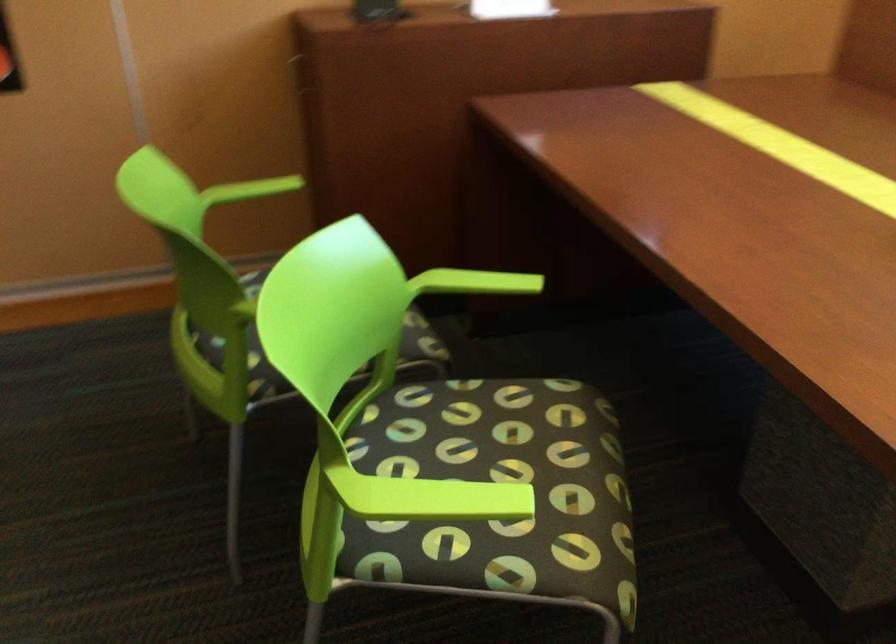
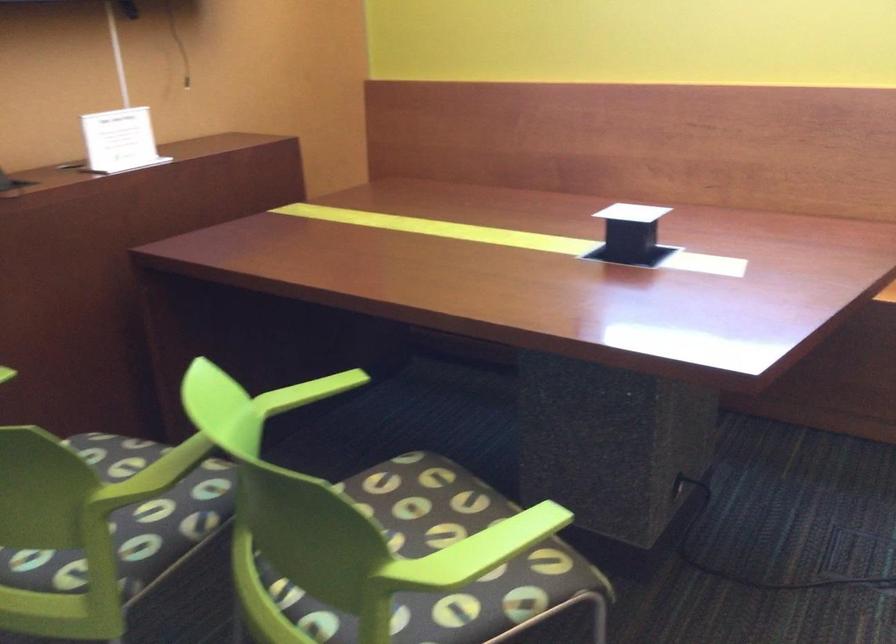
The point at (418, 498) is marked in the first image. Where is the corresponding point in the second image?

(476, 552)